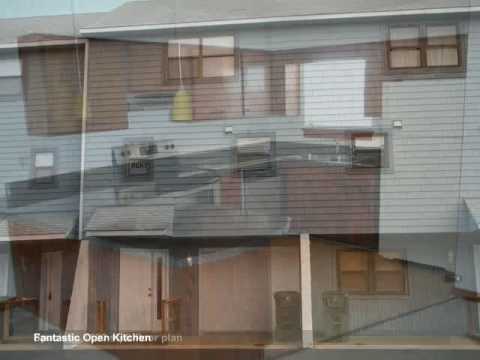
Where is `windows appearing in the glare`? windows appearing in the glare is located at coordinates [x=425, y=57], [x=197, y=61], [x=44, y=169].